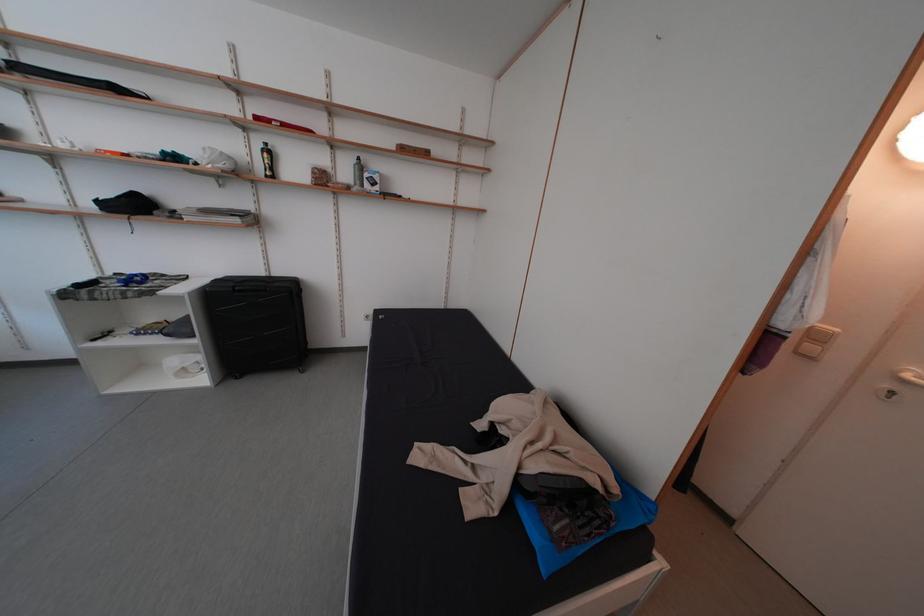
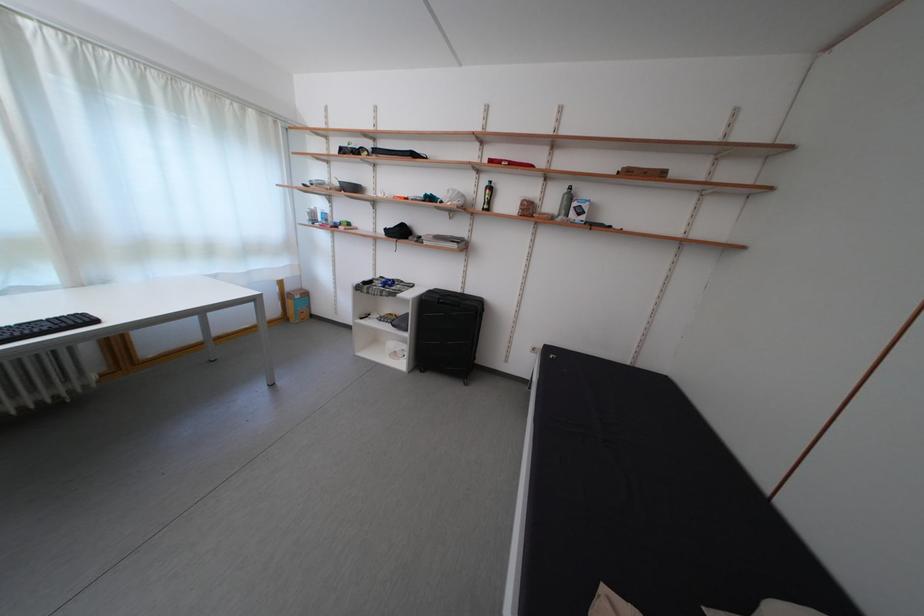
Question: Based on the continuous images, in which direction is the camera rotating? Reply with the corresponding letter.

Choices:
 (A) Left
 (B) Right
 (C) Up
 (D) Down

Answer: (A)